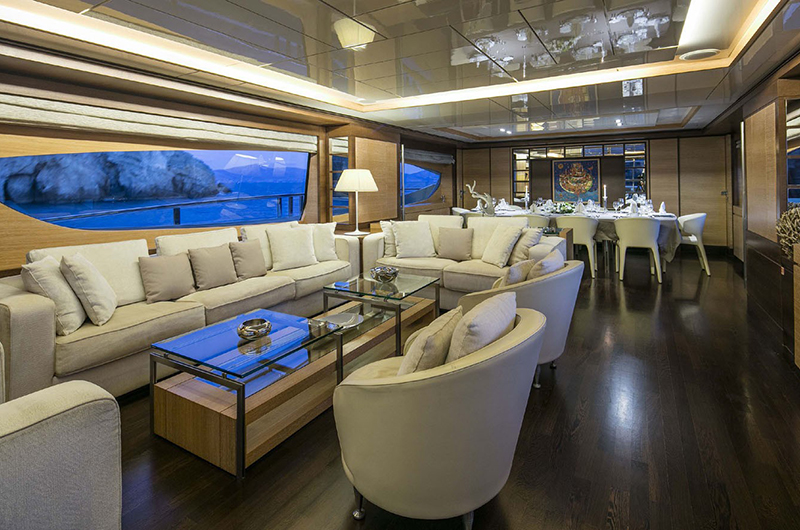
The width and height of the screenshot is (800, 530). Identify the location of couch. (245, 273).